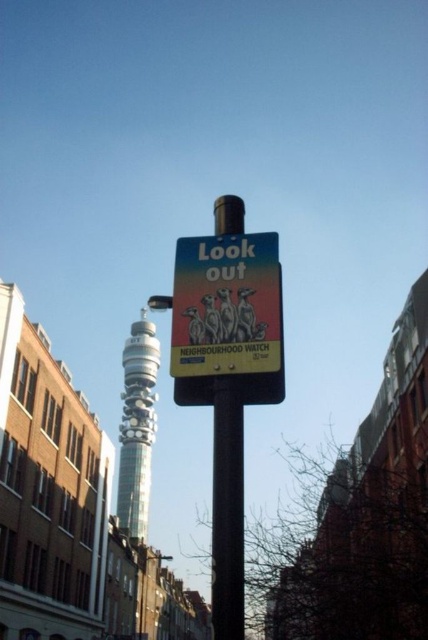
Does smooth metallic pole at center come in front of silver metallic bt tower at center?

Yes, smooth metallic pole at center is in front of silver metallic bt tower at center.

Which is more to the left, smooth metallic pole at center or silver metallic bt tower at center?

From the viewer's perspective, silver metallic bt tower at center appears more on the left side.

Is point (240, 627) closer to viewer compared to point (145, 497)?

That is True.

Find the location of a particular element. The height and width of the screenshot is (640, 428). smooth metallic pole at center is located at coordinates (228, 512).